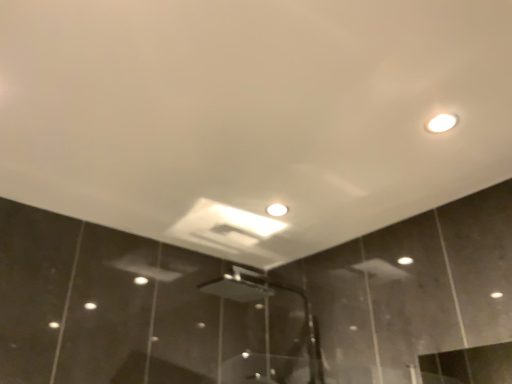
Identify the location of matte white droplight at upper right. (441, 123).

Describe the element at coordinates (441, 123) in the screenshot. I see `matte white droplight at upper right` at that location.

What are the coordinates of `matte white droplight at upper right` in the screenshot? It's located at (441, 123).